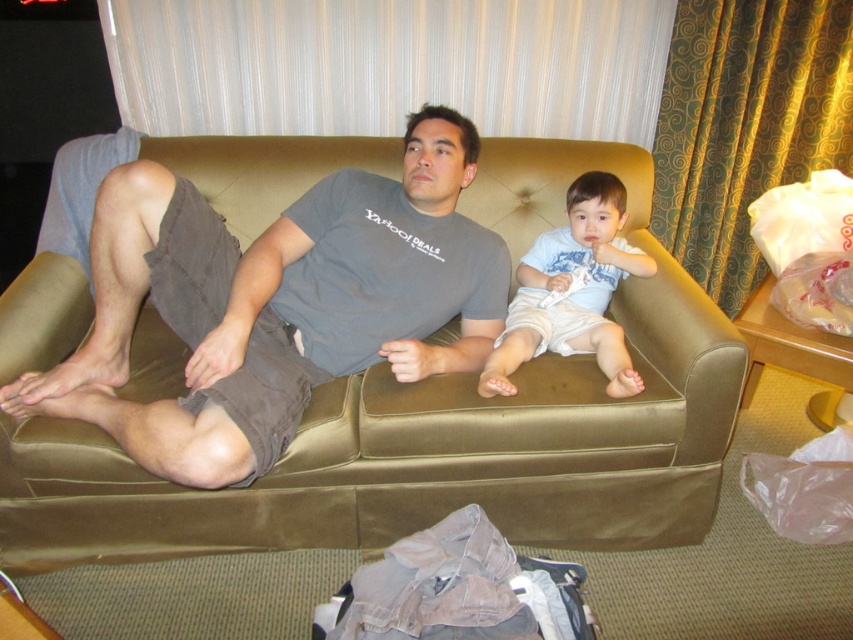
Is suede-like brown couch at center taller than white cotton shirt at center?

Yes.

Is suede-like brown couch at center closer to camera compared to white cotton shirt at center?

Yes.

Between point (293, 532) and point (573, 333), which one is positioned in front?

Point (293, 532) is in front.

Find the location of `suede-like brown couch at center`. suede-like brown couch at center is located at coordinates (434, 428).